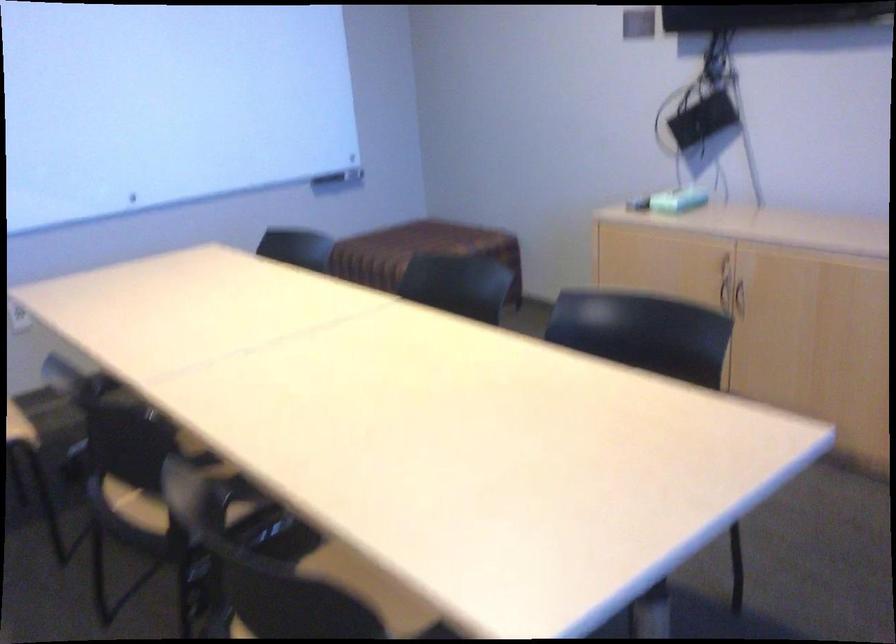
The width and height of the screenshot is (896, 644). I want to click on whiteboard marker tray, so click(339, 178).